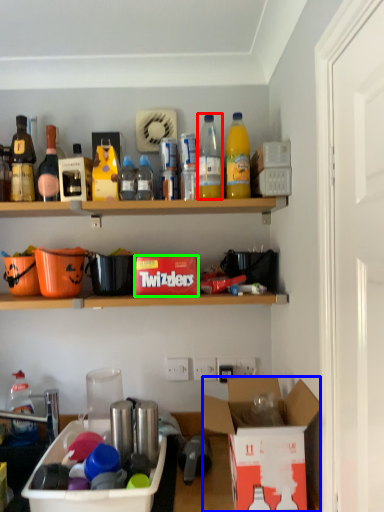
Question: Based on their relative distances, which object is nearer to bottle (highlighted by a red box)? Choose from box (highlighted by a blue box) and box (highlighted by a green box).

Choices:
 (A) box
 (B) box

Answer: (B)